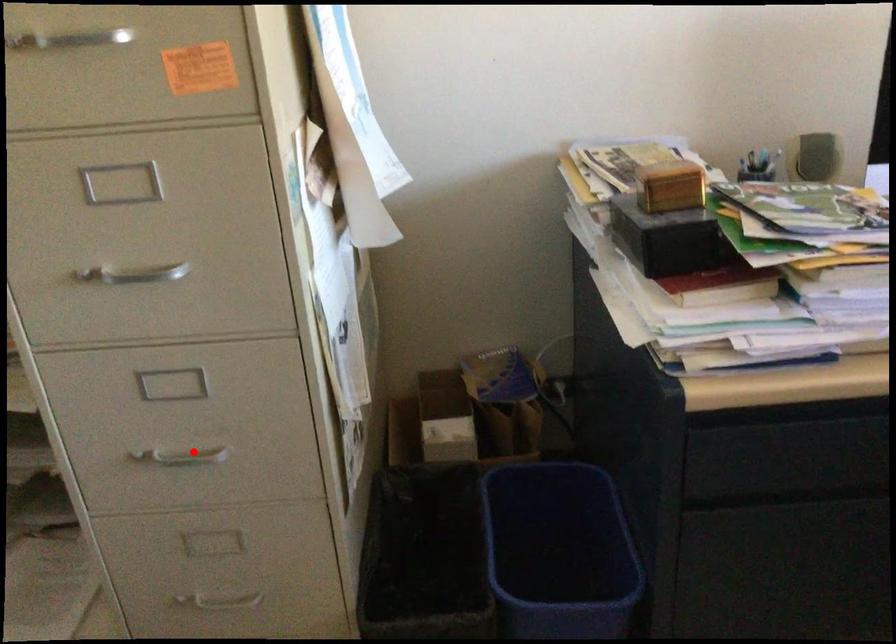
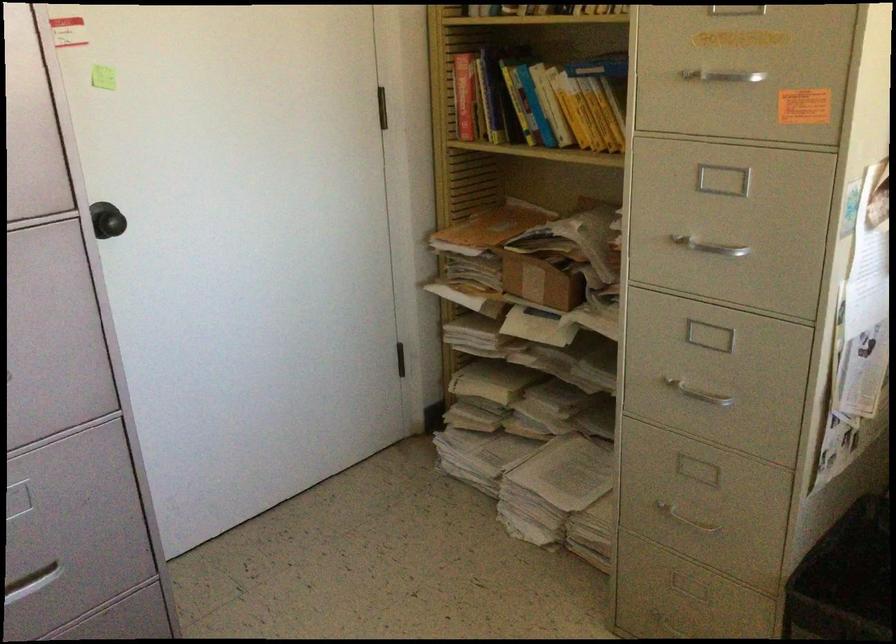
Find the pixel in the second image that matches the highlighted location in the first image.

(699, 391)